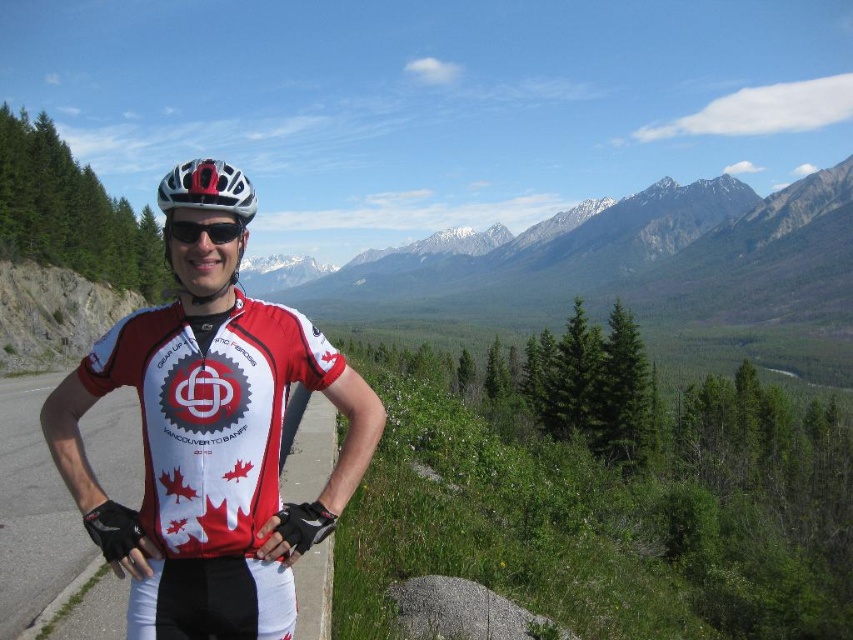
Is white matte helmet at center below white matte bicycle helmet at center?

Correct, white matte helmet at center is located below white matte bicycle helmet at center.

Between point (238, 180) and point (235, 172), which one is positioned behind?

The point (235, 172) is behind.

Is point (190, 192) in front of point (207, 170)?

Yes.

The image size is (853, 640). In order to click on white matte helmet at center in this screenshot , I will do `click(207, 188)`.

Which is behind, point (227, 176) or point (167, 227)?

The point (167, 227) is more distant.

From the picture: Which is more to the right, white matte helmet at center or black matte sunglasses at center?

Positioned to the right is black matte sunglasses at center.

Who is more forward, (177, 198) or (222, 221)?

Point (177, 198)

Identify the location of white matte helmet at center. (207, 188).

Can you confirm if white matte cycling jersey at center is bigger than white matte bicycle helmet at center?

No.

Does point (160, 483) lie behind point (193, 180)?

That is False.

The image size is (853, 640). What do you see at coordinates (210, 451) in the screenshot?
I see `white matte cycling jersey at center` at bounding box center [210, 451].

Locate an element on the screen. This screenshot has height=640, width=853. white matte cycling jersey at center is located at coordinates (210, 451).